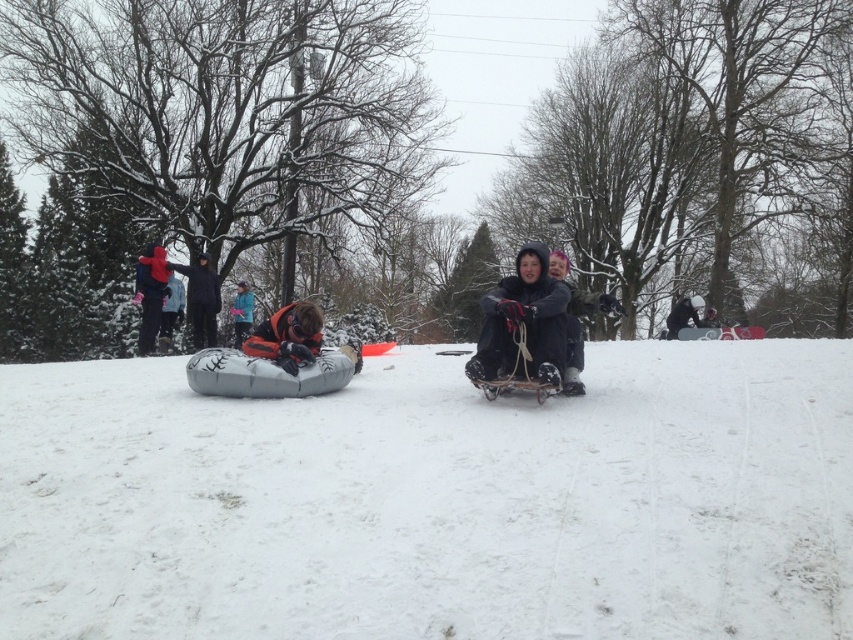
You are a child looking at the snowy slope in the image. You see two areas of white fluffy snow at center and white fluffy snow at upper left. Which area is closer to you?

The white fluffy snow at center is closer to you because it is positioned below the white fluffy snow at upper left, indicating it is in a lower plane relative to your viewpoint.

You are a parent looking at the two children in the snowy scene. You notice the blue fleece jacket at center and the dark gray fabric jacket at center. Which child is positioned lower in the image?

The blue fleece jacket at center is below the dark gray fabric jacket at center, so the child wearing the blue fleece jacket at center is positioned lower in the image.

You are a parent trying to identify your child in the snowy scene. You remember your child wears an orange fleece jacket at center and another child has a blue fleece jacket at center. Which child has a wider jacket?

The orange fleece jacket at center is wider than the blue fleece jacket at center according to the description.